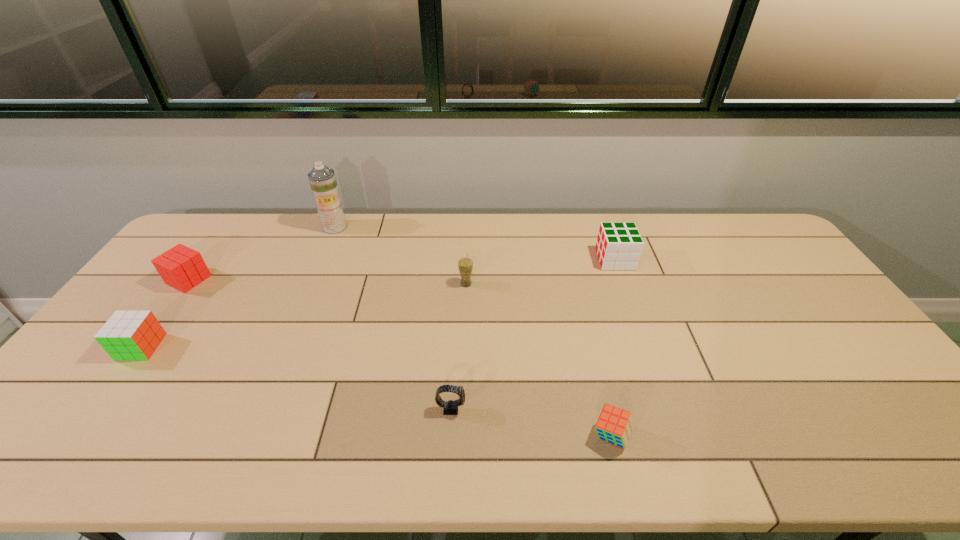
In order to click on the tallest object in this screenshot , I will do `click(322, 179)`.

Locate an element on the screen. aerosol can is located at coordinates (322, 179).

Image resolution: width=960 pixels, height=540 pixels. Find the location of `straw for drinking`. straw for drinking is located at coordinates (465, 265).

Image resolution: width=960 pixels, height=540 pixels. In order to click on the rightmost cube in this screenshot , I will do `click(619, 245)`.

Locate an element on the screen. the rightmost object is located at coordinates (619, 245).

You are a GUI agent. You are given a task and a screenshot of the screen. Output one action in this format:
    pyautogui.click(x=<x>, y=<y>)
    Task: Click on the third nearest object
    The image size is (960, 540).
    Given the screenshot: What is the action you would take?
    pyautogui.click(x=128, y=335)

In order to click on the second nearest object in this screenshot , I will do `click(451, 407)`.

This screenshot has height=540, width=960. Identify the location of the second cube from right to left. (614, 425).

Identify the location of the nearest cube. Image resolution: width=960 pixels, height=540 pixels. (614, 425).

The width and height of the screenshot is (960, 540). What are the coordinates of `vacant area located on the front of the farthest object` in the screenshot? It's located at (324, 254).